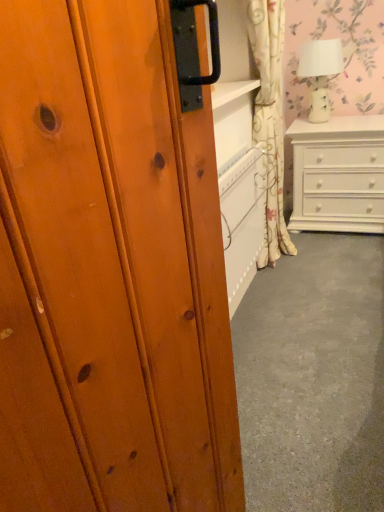
Question: Is floral fabric curtain at upper right bigger or smaller than white ceramic lamp at upper right?

Choices:
 (A) small
 (B) big

Answer: (B)

Question: Is point (269, 41) closer or farther from the camera than point (322, 39)?

Choices:
 (A) farther
 (B) closer

Answer: (B)

Question: Estimate the real-world distances between objects in this image. Which object is farther from the floral fabric curtain at upper right?

Choices:
 (A) white glossy chest of drawers at right
 (B) white ceramic lamp at upper right

Answer: (B)

Question: Estimate the real-world distances between objects in this image. Which object is closer to the floral fabric curtain at upper right?

Choices:
 (A) white ceramic lamp at upper right
 (B) white glossy chest of drawers at right

Answer: (B)